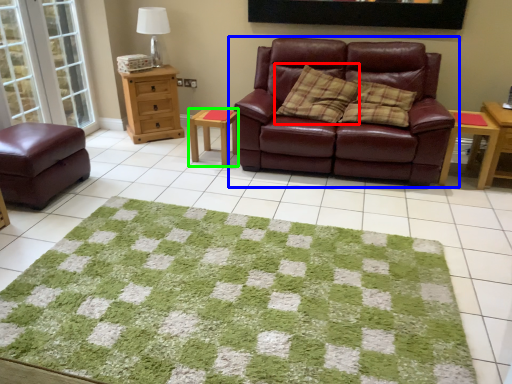
Question: Estimate the real-world distances between objects in this image. Which object is farther from pillow (highlighted by a red box), studio couch (highlighted by a blue box) or table (highlighted by a green box)?

Choices:
 (A) studio couch
 (B) table

Answer: (B)